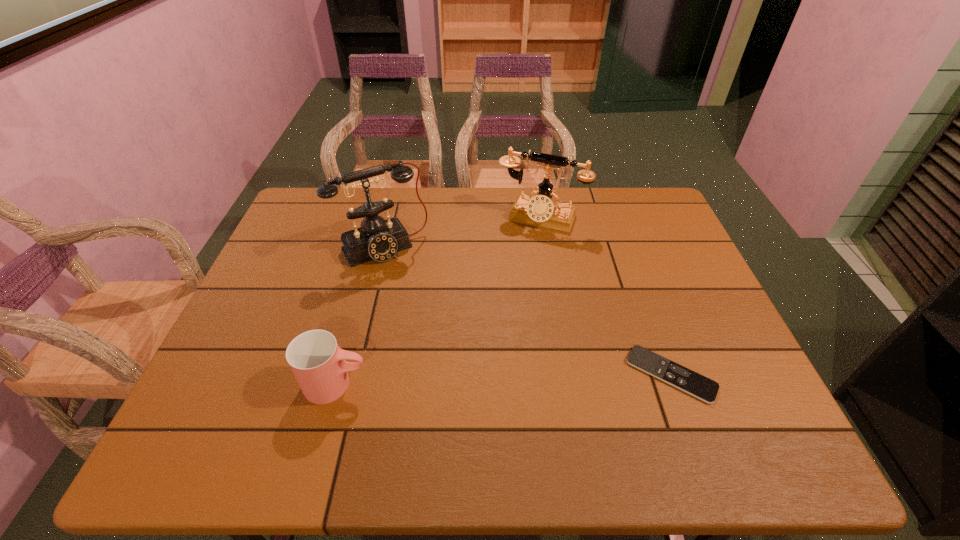
Where is `vacant space on the desktop that is between the cup and the remote control and is positioned on the dial of the shorter telephone`? The width and height of the screenshot is (960, 540). vacant space on the desktop that is between the cup and the remote control and is positioned on the dial of the shorter telephone is located at coordinates click(x=468, y=380).

Find the location of a particular element. This screenshot has height=540, width=960. vacant space on the desktop that is between the cup and the shortest object and is positioned on the dial of the left telephone is located at coordinates (464, 381).